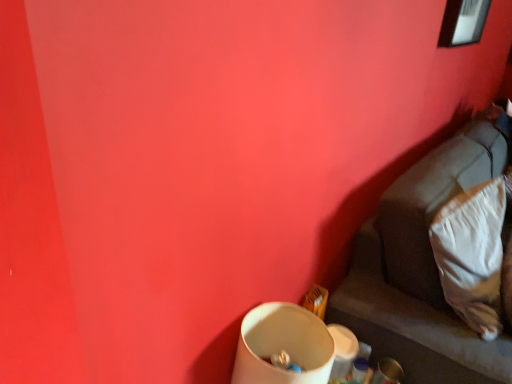
Question: Can you confirm if white soft pillow at lower right is positioned to the right of suede-like beige couch at lower right?

Choices:
 (A) no
 (B) yes

Answer: (A)

Question: Is white soft pillow at lower right at the left side of suede-like beige couch at lower right?

Choices:
 (A) no
 (B) yes

Answer: (B)

Question: Could suede-like beige couch at lower right be considered to be inside white soft pillow at lower right?

Choices:
 (A) yes
 (B) no

Answer: (B)

Question: Does white soft pillow at lower right have a greater height compared to suede-like beige couch at lower right?

Choices:
 (A) no
 (B) yes

Answer: (A)

Question: Is white soft pillow at lower right closer to the viewer compared to suede-like beige couch at lower right?

Choices:
 (A) no
 (B) yes

Answer: (A)

Question: Is white soft pillow at lower right looking in the opposite direction of suede-like beige couch at lower right?

Choices:
 (A) no
 (B) yes

Answer: (B)

Question: Can you confirm if suede-like beige couch at lower right is positioned to the left of white soft pillow at lower right?

Choices:
 (A) yes
 (B) no

Answer: (B)

Question: Is white soft pillow at lower right at the back of suede-like beige couch at lower right?

Choices:
 (A) yes
 (B) no

Answer: (A)

Question: Is suede-like beige couch at lower right oriented towards white soft pillow at lower right?

Choices:
 (A) yes
 (B) no

Answer: (A)

Question: Is the depth of suede-like beige couch at lower right less than that of white soft pillow at lower right?

Choices:
 (A) yes
 (B) no

Answer: (A)

Question: Can you confirm if suede-like beige couch at lower right is wider than white soft pillow at lower right?

Choices:
 (A) yes
 (B) no

Answer: (A)

Question: From the image's perspective, would you say suede-like beige couch at lower right is positioned over white soft pillow at lower right?

Choices:
 (A) no
 (B) yes

Answer: (A)

Question: Considering the positions of point (375, 304) and point (480, 249), is point (375, 304) closer or farther from the camera than point (480, 249)?

Choices:
 (A) closer
 (B) farther

Answer: (B)